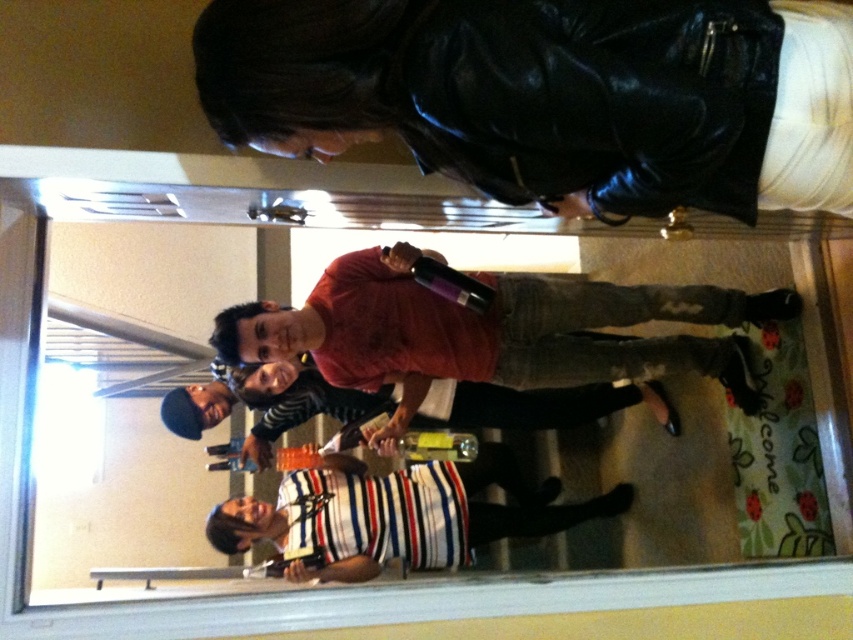
Does striped fabric shirt at lower center lie in front of striped cotton shirt at center?

Yes, striped fabric shirt at lower center is in front of striped cotton shirt at center.

Does striped fabric shirt at lower center have a smaller size compared to striped cotton shirt at center?

No.

Which is in front, point (442, 515) or point (480, 410)?

Point (442, 515) is more forward.

Locate an element on the screen. The width and height of the screenshot is (853, 640). striped fabric shirt at lower center is located at coordinates (399, 515).

Which is more to the right, black leather jacket at upper center or striped cotton shirt at center?

black leather jacket at upper center is more to the right.

Does black leather jacket at upper center appear over striped cotton shirt at center?

Correct, black leather jacket at upper center is located above striped cotton shirt at center.

Does point (631, 118) come farther from viewer compared to point (260, 400)?

No, (631, 118) is closer to viewer.

Where is `black leather jacket at upper center`? Image resolution: width=853 pixels, height=640 pixels. black leather jacket at upper center is located at coordinates (552, 96).

Does black leather jacket at upper center appear over striped fabric shirt at lower center?

Correct, black leather jacket at upper center is located above striped fabric shirt at lower center.

Which is more to the right, black leather jacket at upper center or striped fabric shirt at lower center?

black leather jacket at upper center is more to the right.

Locate an element on the screen. The image size is (853, 640). black leather jacket at upper center is located at coordinates (552, 96).